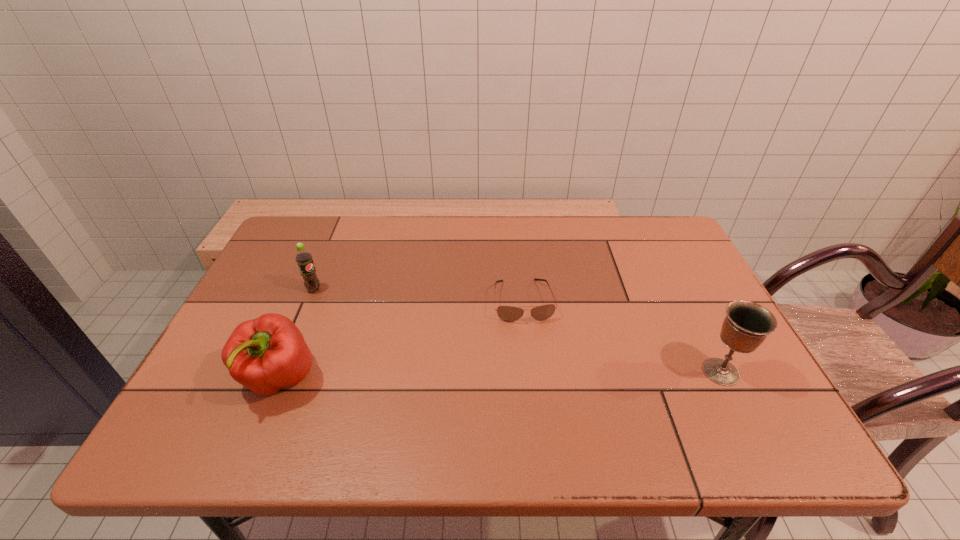
You are a GUI agent. You are given a task and a screenshot of the screen. Output one action in this format:
    pyautogui.click(x=<x>, y=<y>)
    Task: Click on the vacant spot on the desktop that is between the bell pepper and the chalice and is positioned on the front label of the soda
    
    Given the screenshot: What is the action you would take?
    pyautogui.click(x=439, y=376)

The image size is (960, 540). In order to click on vacant space on the desktop that is between the bell pepper and the rightmost object and is positioned on the front-facing side of the shortest object in this screenshot , I will do `click(537, 375)`.